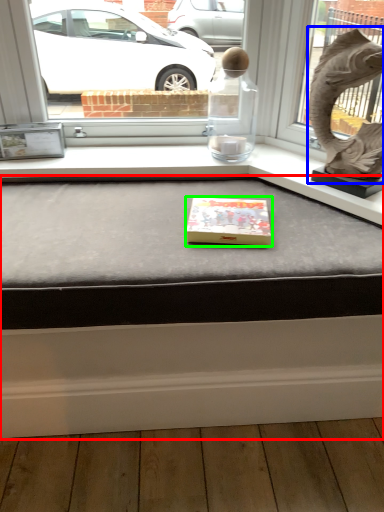
Question: Which object is positioned closest to table (highlighted by a red box)? Select from animal sculpture (highlighted by a blue box) and box (highlighted by a green box).

Choices:
 (A) animal sculpture
 (B) box

Answer: (B)